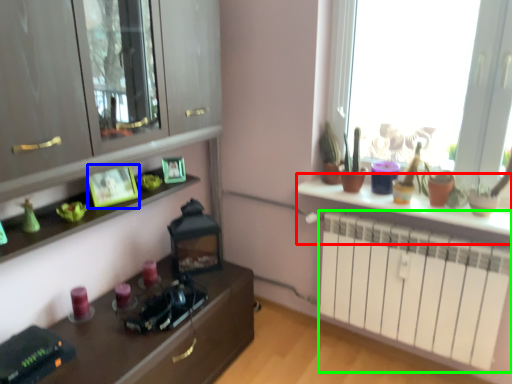
Question: Considering the real-world distances, which object is farthest from table (highlighted by a red box)? picture frame (highlighted by a blue box) or radiator (highlighted by a green box)?

Choices:
 (A) picture frame
 (B) radiator

Answer: (A)